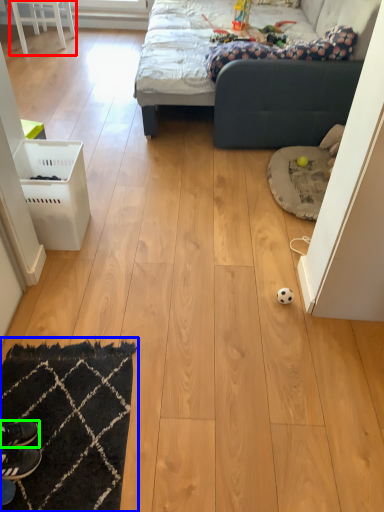
Question: Which object is the closest to the furniture (highlighted by a red box)? Choose among these: mat (highlighted by a blue box) or footwear (highlighted by a green box).

Choices:
 (A) mat
 (B) footwear

Answer: (A)